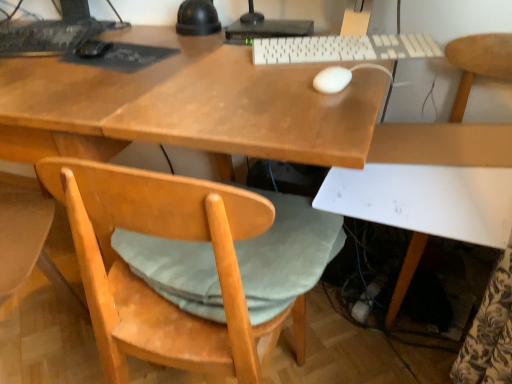
Where is `free space on the front side of dark gray matte mousepad at upper left`? free space on the front side of dark gray matte mousepad at upper left is located at coordinates (96, 80).